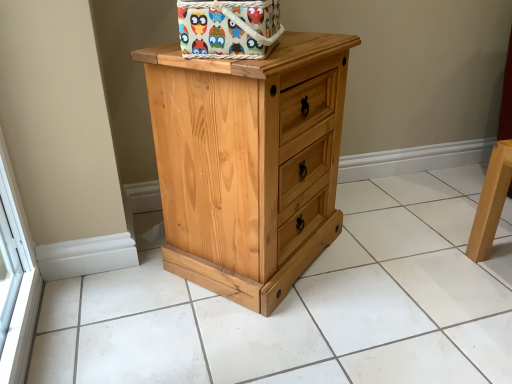
Question: From the image's perspective, is natural wood chest of drawers at center located beneath multicolored fabric basket at top center?

Choices:
 (A) no
 (B) yes

Answer: (B)

Question: Could multicolored fabric basket at top center be considered to be inside natural wood chest of drawers at center?

Choices:
 (A) yes
 (B) no

Answer: (B)

Question: Is natural wood chest of drawers at center positioned beyond the bounds of multicolored fabric basket at top center?

Choices:
 (A) yes
 (B) no

Answer: (A)

Question: Considering the relative sizes of natural wood chest of drawers at center and multicolored fabric basket at top center in the image provided, is natural wood chest of drawers at center wider than multicolored fabric basket at top center?

Choices:
 (A) no
 (B) yes

Answer: (B)

Question: Is natural wood chest of drawers at center not near multicolored fabric basket at top center?

Choices:
 (A) yes
 (B) no

Answer: (B)

Question: Is natural wood chest of drawers at center taller than multicolored fabric basket at top center?

Choices:
 (A) no
 (B) yes

Answer: (B)

Question: Does multicolored fabric basket at top center have a lesser height compared to natural wood chest of drawers at center?

Choices:
 (A) no
 (B) yes

Answer: (B)

Question: Is the depth of multicolored fabric basket at top center greater than that of natural wood chest of drawers at center?

Choices:
 (A) yes
 (B) no

Answer: (B)

Question: Is natural wood chest of drawers at center inside multicolored fabric basket at top center?

Choices:
 (A) no
 (B) yes

Answer: (A)

Question: From a real-world perspective, is multicolored fabric basket at top center below natural wood chest of drawers at center?

Choices:
 (A) no
 (B) yes

Answer: (A)

Question: Does multicolored fabric basket at top center appear on the left side of natural wood chest of drawers at center?

Choices:
 (A) no
 (B) yes

Answer: (B)

Question: Is multicolored fabric basket at top center thinner than natural wood chest of drawers at center?

Choices:
 (A) yes
 (B) no

Answer: (A)

Question: From the image's perspective, is natural wood cabinet at center under multicolored fabric basket at top center?

Choices:
 (A) no
 (B) yes

Answer: (B)